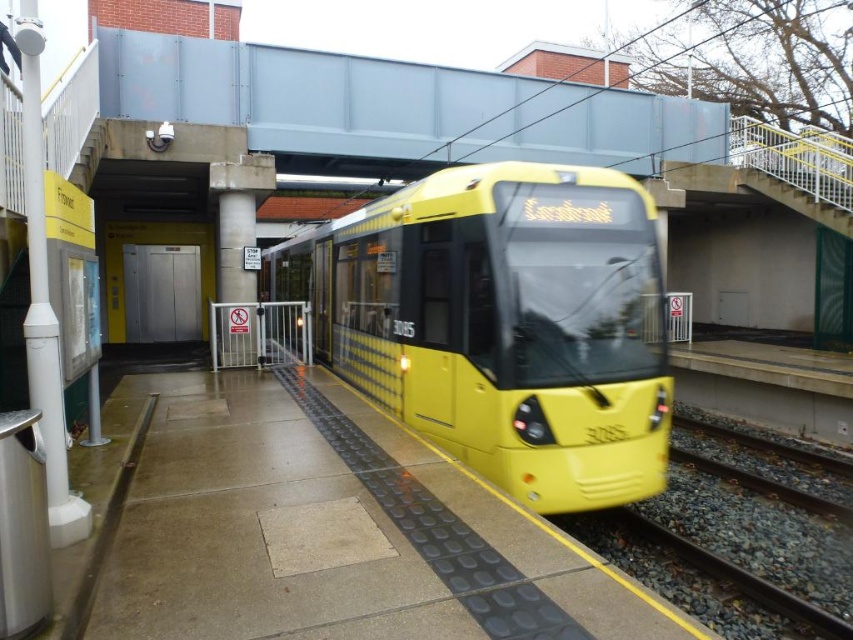
You are a passenger waiting on the platform and want to board the yellow matte train at center. The gravel train track at lower right is where the train will stop. Is the train already at the boarding position?

The yellow matte train at center is closer to the viewer than the gravel train track at lower right, so the train has not yet reached the boarding position and is still approaching the gravel train track at lower right.

You are standing on the platform and want to board the yellow matte train at center. Where should you position yourself relative to the tactile paving strip to ensure you are closest to the train?

The yellow matte train at center is located at point (502, 323), so you should position yourself directly over the tactile paving strip since it is the closest safety feature to the train on the platform.